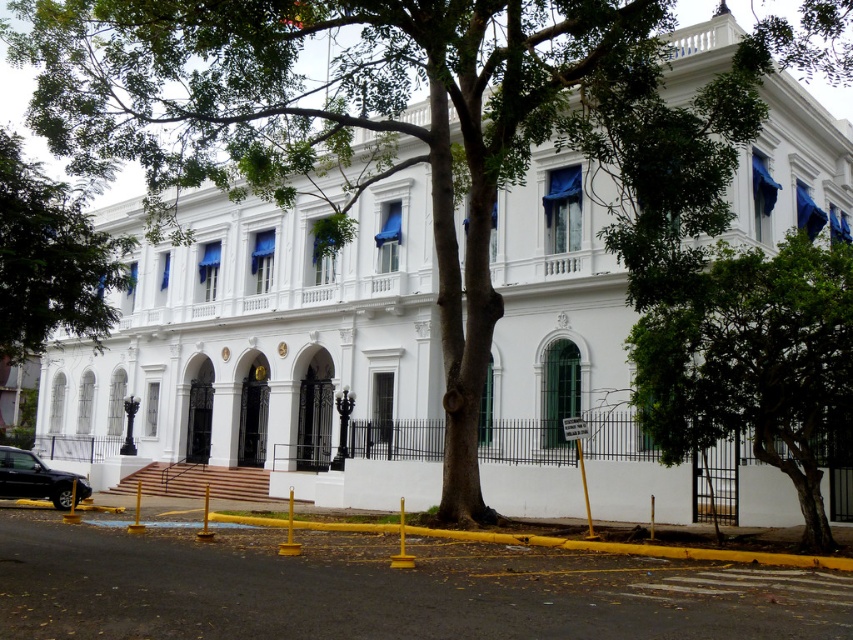
Question: Is green leafy tree at center in front of green leafy tree at left?

Choices:
 (A) no
 (B) yes

Answer: (B)

Question: Which of the following is the farthest from the observer?

Choices:
 (A) green leafy tree at left
 (B) green leafy tree at center

Answer: (A)

Question: Does green leafy tree at center have a lesser width compared to shiny black sedan at lower left?

Choices:
 (A) no
 (B) yes

Answer: (A)

Question: Does green leafy tree at center appear on the right side of shiny black sedan at lower left?

Choices:
 (A) yes
 (B) no

Answer: (A)

Question: Which point appears farthest from the camera in this image?

Choices:
 (A) (79, 275)
 (B) (39, 476)
 (C) (787, 269)

Answer: (B)

Question: Which object is positioned closest to the green leafy tree at center?

Choices:
 (A) green leafy tree at left
 (B) shiny black sedan at lower left

Answer: (A)